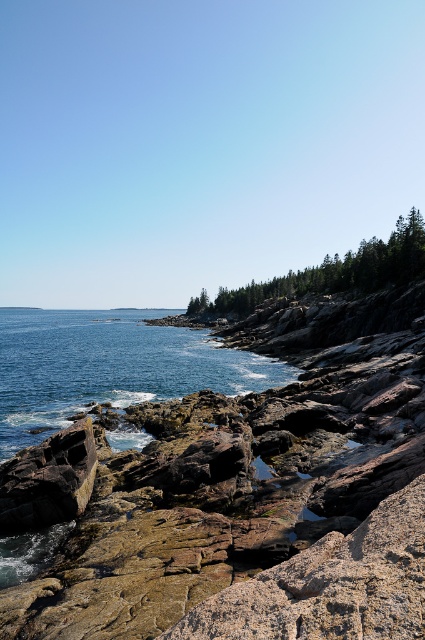
Between point (308, 291) and point (53, 442), which one is positioned behind?

The point (308, 291) is more distant.

Is green textured trees at center behind rusty rock at lower left?

That is True.

Which is behind, point (217, 308) or point (71, 504)?

Point (217, 308)

Locate an element on the screen. The width and height of the screenshot is (425, 640). green textured trees at center is located at coordinates (334, 273).

In the scene shown: Is blue water at center taller than green textured trees at center?

No, blue water at center is not taller than green textured trees at center.

Is point (90, 321) more distant than point (238, 291)?

Yes.

The image size is (425, 640). I want to click on blue water at center, so click(x=108, y=365).

Which is below, blue water at center or rusty rock at lower left?

rusty rock at lower left is lower down.

Does blue water at center have a greater width compared to rusty rock at lower left?

Yes, blue water at center is wider than rusty rock at lower left.

What do you see at coordinates (108, 365) in the screenshot?
I see `blue water at center` at bounding box center [108, 365].

At what (x,y) coordinates should I click in order to perform the action: click on blue water at center. Please return your answer as a coordinate pair (x, y). Looking at the image, I should click on (108, 365).